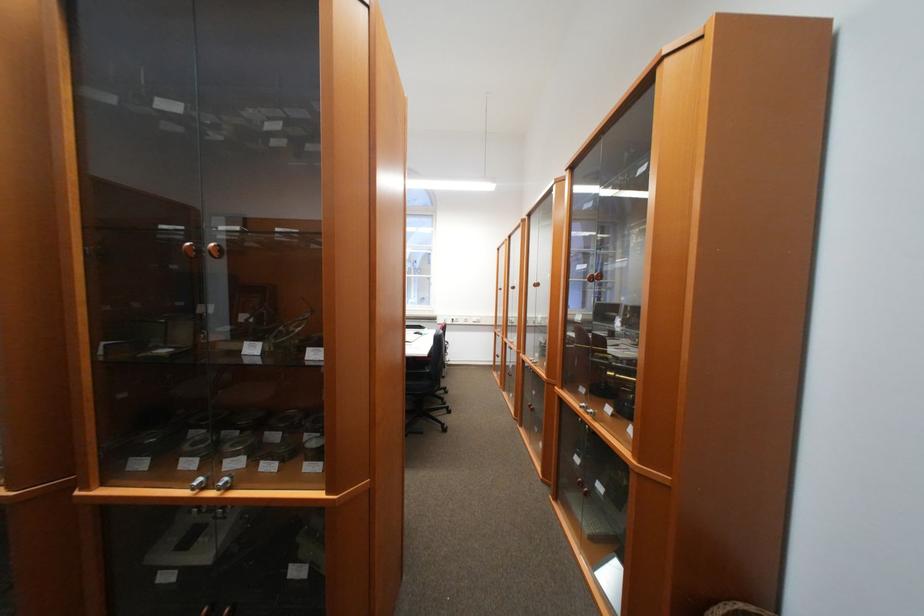
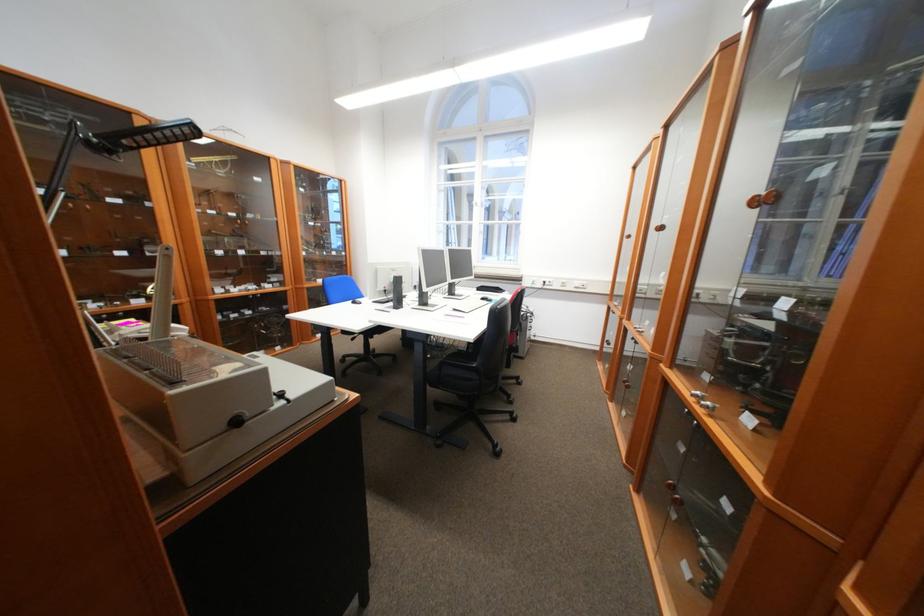
In the second image, find the point that corresponds to [502,361] in the first image.

(609, 345)